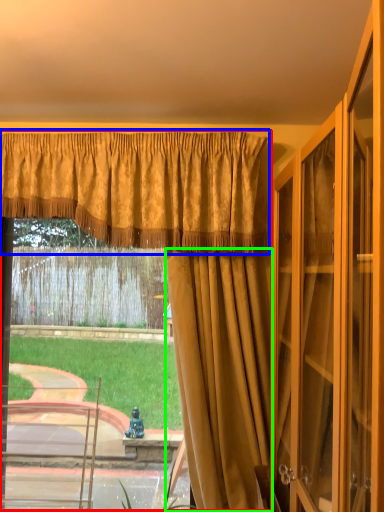
Question: Estimate the real-world distances between objects in this image. Which object is closer to curtain (highlighted by a red box), curtain (highlighted by a blue box) or curtain (highlighted by a green box)?

Choices:
 (A) curtain
 (B) curtain

Answer: (B)